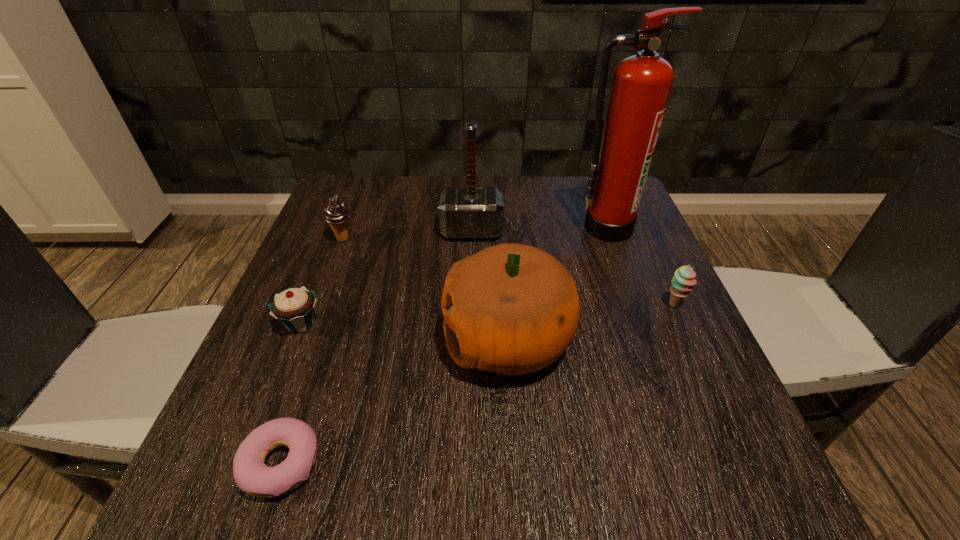
At what (x,y) coordinates should I click in order to perform the action: click on vacant space situated on the face of the third tallest object. Please return your answer as a coordinate pair (x, y). Looking at the image, I should click on (285, 339).

Image resolution: width=960 pixels, height=540 pixels. Identify the location of free space located on the face of the third tallest object. (275, 339).

The width and height of the screenshot is (960, 540). I want to click on vacant area situated on the face of the third tallest object, so click(x=257, y=339).

The width and height of the screenshot is (960, 540). I want to click on vacant area situated 0.360m on the right of the icecream, so click(x=510, y=238).

I want to click on vacant area situated 0.140m on the front of the sherbert, so click(706, 373).

This screenshot has width=960, height=540. I want to click on free spot located 0.190m on the right of the sixth tallest object, so click(x=424, y=323).

What are the coordinates of `free region located on the right of the nearest object` in the screenshot? It's located at (369, 464).

Image resolution: width=960 pixels, height=540 pixels. What are the coordinates of `fire extinguisher present at the far edge` in the screenshot? It's located at (641, 85).

Locate an element on the screen. hammer present at the far edge is located at coordinates (464, 213).

I want to click on object located in the near edge section of the desktop, so click(x=250, y=473).